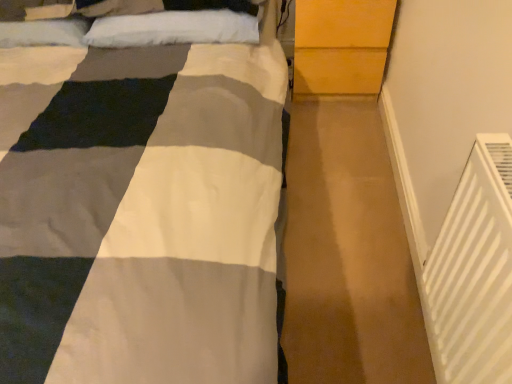
Question: Would you say white fluffy pillow at upper center is a long distance from white plastic radiator at lower right?

Choices:
 (A) yes
 (B) no

Answer: (A)

Question: From the image's perspective, does white fluffy pillow at upper center appear higher than white plastic radiator at lower right?

Choices:
 (A) yes
 (B) no

Answer: (A)

Question: Is white fluffy pillow at upper center shorter than white plastic radiator at lower right?

Choices:
 (A) no
 (B) yes

Answer: (B)

Question: From a real-world perspective, is white fluffy pillow at upper center positioned under white plastic radiator at lower right based on gravity?

Choices:
 (A) yes
 (B) no

Answer: (A)

Question: Is white fluffy pillow at upper center oriented away from white plastic radiator at lower right?

Choices:
 (A) no
 (B) yes

Answer: (A)

Question: Are white fluffy pillow at upper center and white plastic radiator at lower right beside each other?

Choices:
 (A) no
 (B) yes

Answer: (A)

Question: Considering the relative sizes of white fluffy pillow at upper center and light brown wood dresser at upper right in the image provided, is white fluffy pillow at upper center taller than light brown wood dresser at upper right?

Choices:
 (A) no
 (B) yes

Answer: (A)

Question: From the image's perspective, is white fluffy pillow at upper center above light brown wood dresser at upper right?

Choices:
 (A) yes
 (B) no

Answer: (B)

Question: Does white fluffy pillow at upper center have a lesser height compared to light brown wood dresser at upper right?

Choices:
 (A) yes
 (B) no

Answer: (A)

Question: Does white fluffy pillow at upper center have a lesser width compared to light brown wood dresser at upper right?

Choices:
 (A) no
 (B) yes

Answer: (B)

Question: Does white fluffy pillow at upper center contain light brown wood dresser at upper right?

Choices:
 (A) no
 (B) yes

Answer: (A)

Question: Is white fluffy pillow at upper center bigger than light brown wood dresser at upper right?

Choices:
 (A) yes
 (B) no

Answer: (B)

Question: Considering the relative positions of light brown wood dresser at upper right and white fluffy pillow at upper center in the image provided, is light brown wood dresser at upper right to the left of white fluffy pillow at upper center from the viewer's perspective?

Choices:
 (A) yes
 (B) no

Answer: (B)